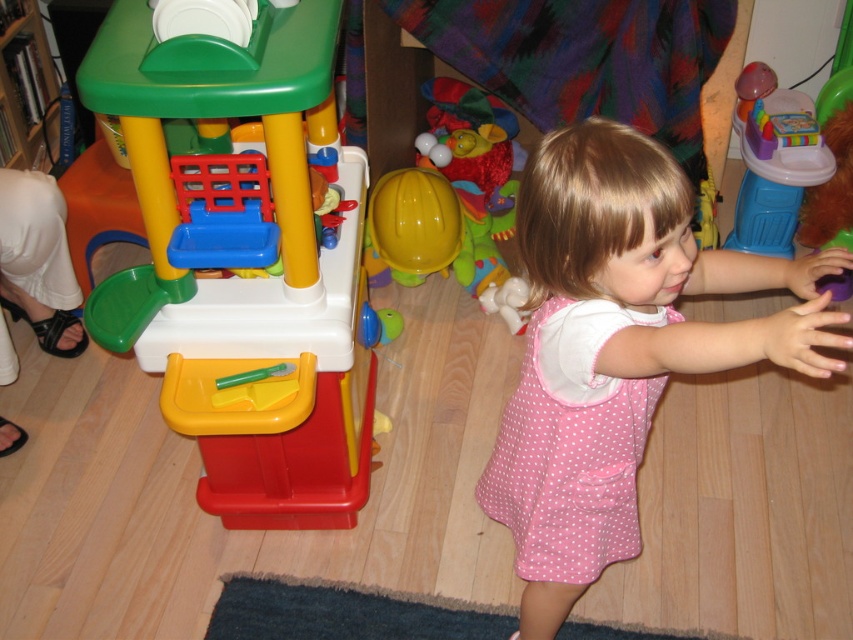
Based on the photo, is pink dotted dress at center thinner than yellow plastic hard hat at center?

No.

Who is positioned more to the right, pink dotted dress at center or yellow plastic hard hat at center?

pink dotted dress at center

The width and height of the screenshot is (853, 640). What do you see at coordinates (618, 349) in the screenshot? I see `pink dotted dress at center` at bounding box center [618, 349].

In order to click on pink dotted dress at center in this screenshot , I will do `click(618, 349)`.

Is pink polka dot dress at center further to camera compared to translucent plastic toy at right?

No, it is in front of translucent plastic toy at right.

Is point (523, 461) more distant than point (761, 106)?

No, (523, 461) is closer to viewer.

Who is more forward, (584, 515) or (734, 214)?

Point (584, 515)

This screenshot has width=853, height=640. What are the coordinates of `pink polka dot dress at center` in the screenshot? It's located at (567, 468).

Who is more forward, (312, 348) or (534, 259)?

Positioned in front is point (534, 259).

Is plastic play kitchen at left wider than pink dotted dress at center?

Yes.

Who is more forward, (x=299, y=436) or (x=621, y=416)?

Point (x=621, y=416) is more forward.

The height and width of the screenshot is (640, 853). I want to click on plastic play kitchen at left, so click(x=242, y=260).